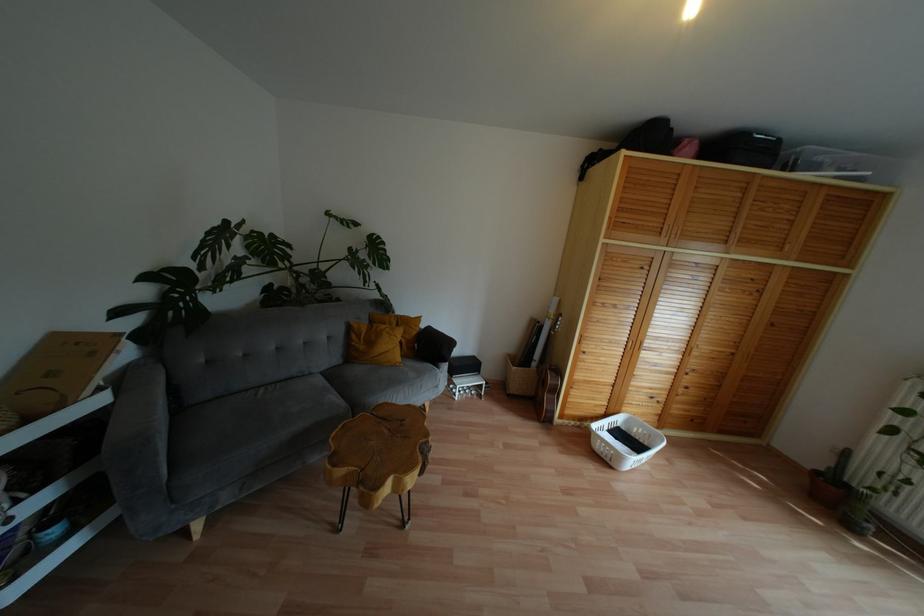
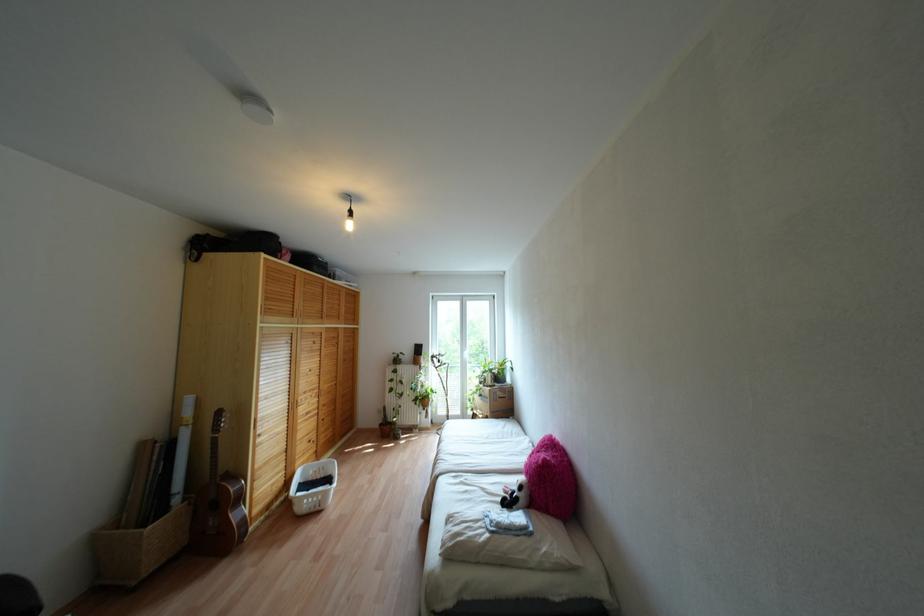
In the second image, find the point that corresponds to point (568, 399) in the first image.

(253, 495)